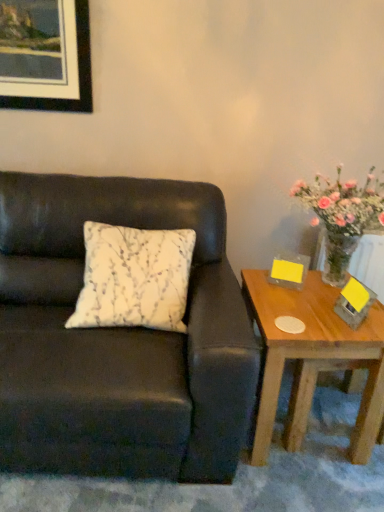
Where is `vacant area on top of wooden table at right (from a real-world perspective)`? The width and height of the screenshot is (384, 512). vacant area on top of wooden table at right (from a real-world perspective) is located at coordinates (311, 312).